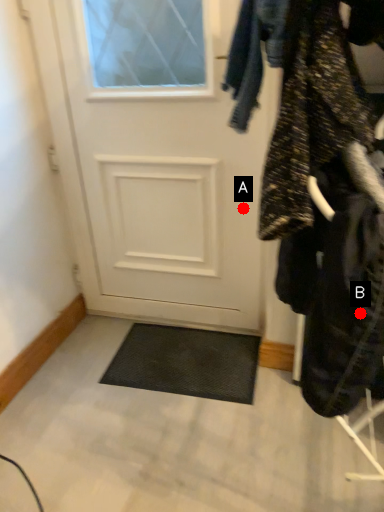
Question: Two points are circled on the image, labeled by A and B beside each circle. Which point is further to the camera?

Choices:
 (A) A is further
 (B) B is further

Answer: (A)